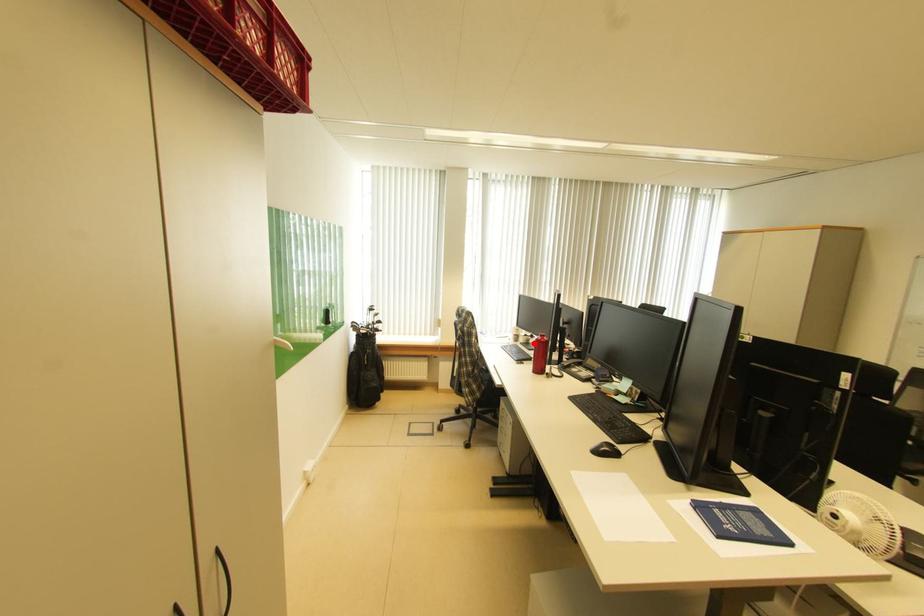
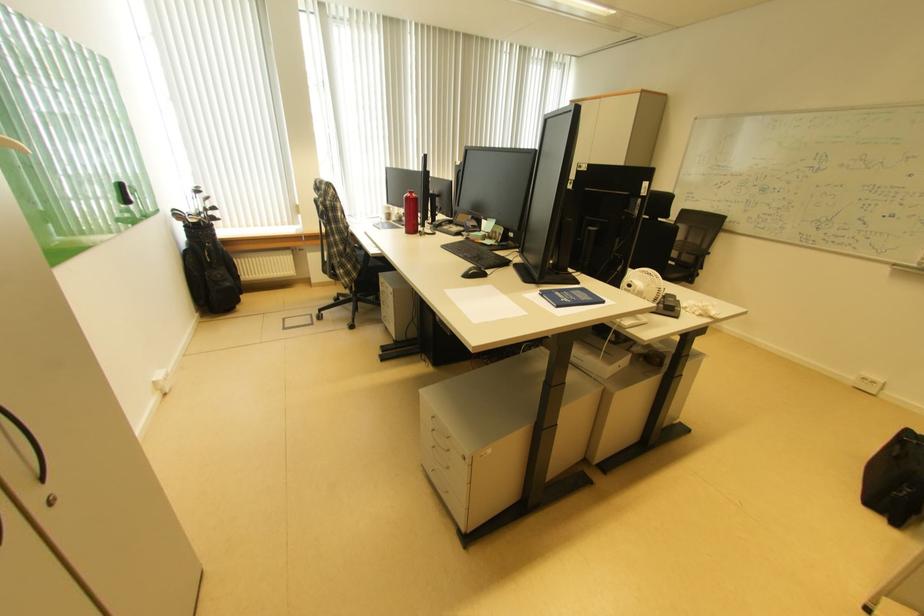
In the second image, find the point that corresponds to the highlighted location in the first image.

(407, 221)